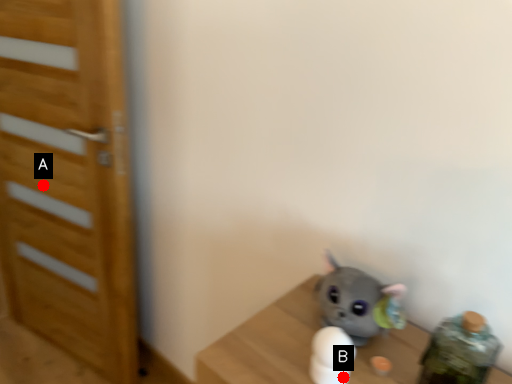
Question: Two points are circled on the image, labeled by A and B beside each circle. Among these points, which one is nearest to the camera?

Choices:
 (A) A is closer
 (B) B is closer

Answer: (B)